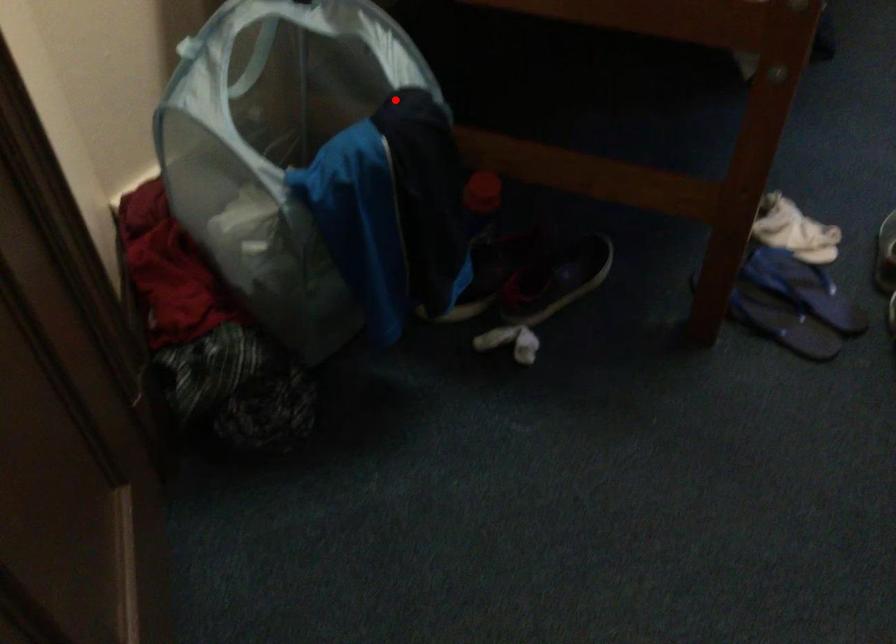
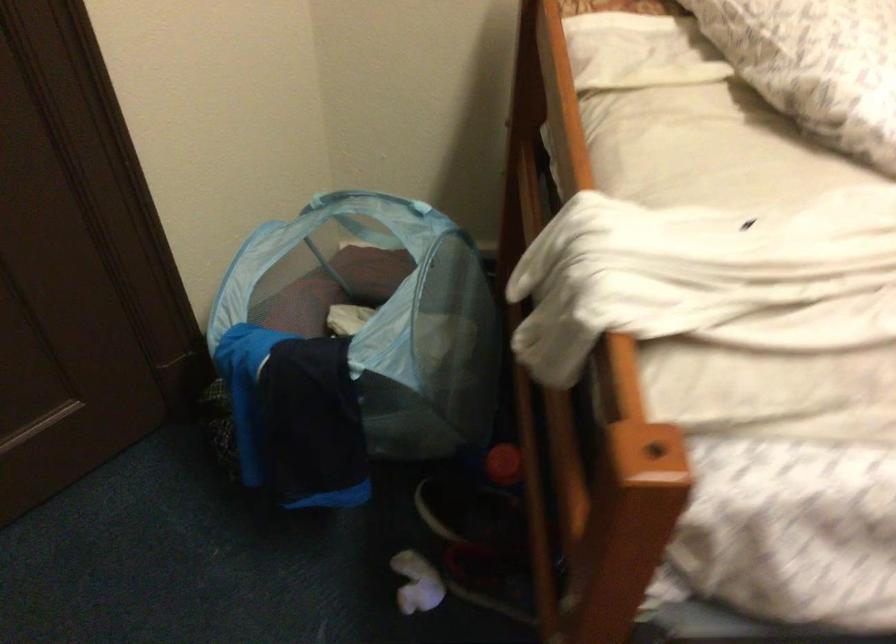
Question: A red point is marked in image1. In image2, is the corresponding 3D point closer to the camera or farther? Reply with the corresponding letter.

Choices:
 (A) The corresponding 3D point is closer.
 (B) The corresponding 3D point is farther.

Answer: (B)